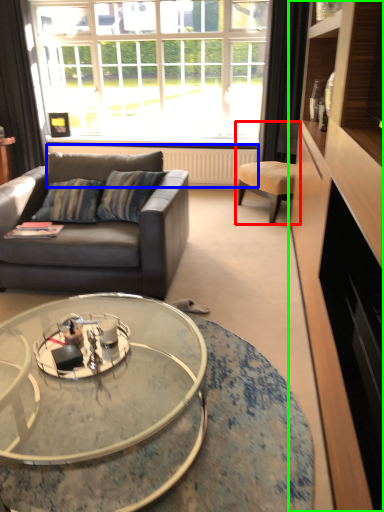
Question: Which object is positioned farthest from chair (highlighted by a red box)? Select from radiator (highlighted by a blue box) and cabinetry (highlighted by a green box).

Choices:
 (A) radiator
 (B) cabinetry

Answer: (B)